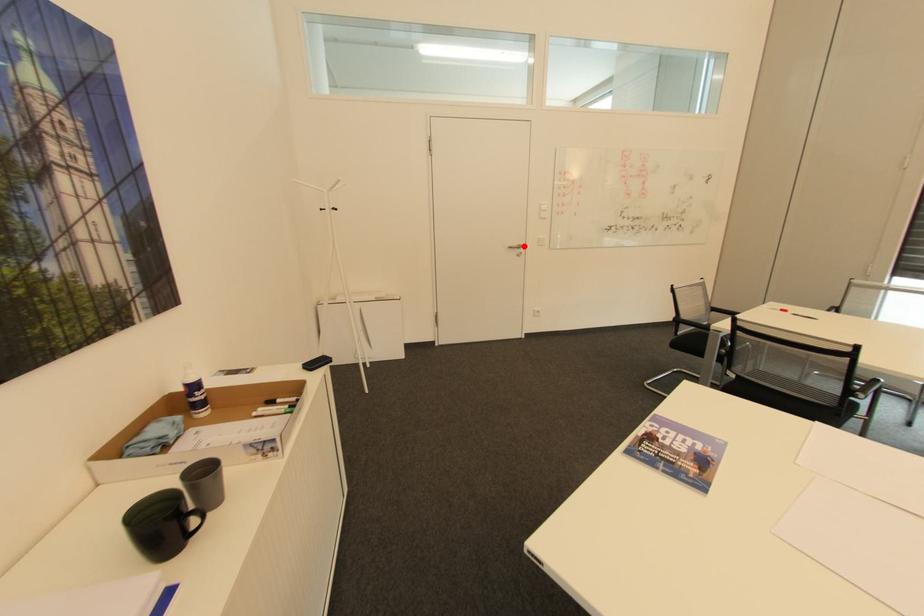
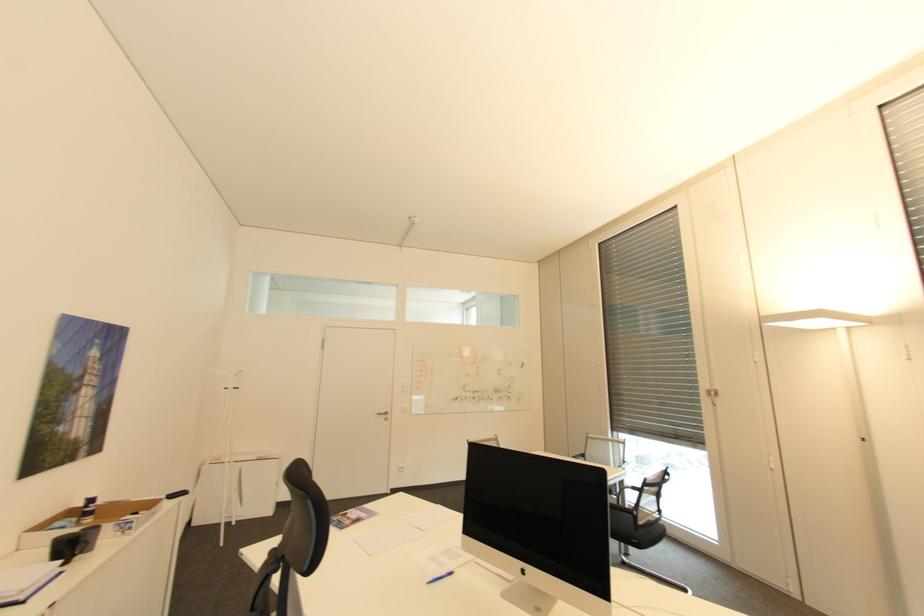
In the second image, find the point that corresponds to the highlighted location in the first image.

(391, 413)